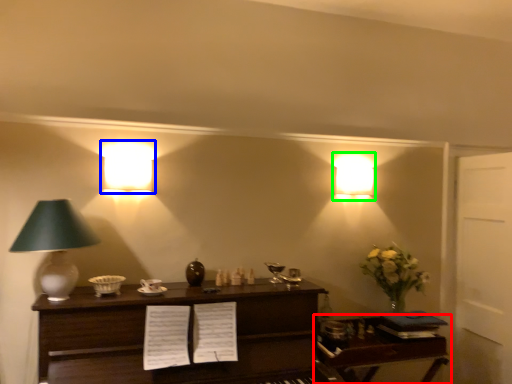
Question: Based on their relative distances, which object is nearer to table (highlighted by a red box)? Choose from lamp (highlighted by a blue box) and lamp (highlighted by a green box).

Choices:
 (A) lamp
 (B) lamp

Answer: (B)